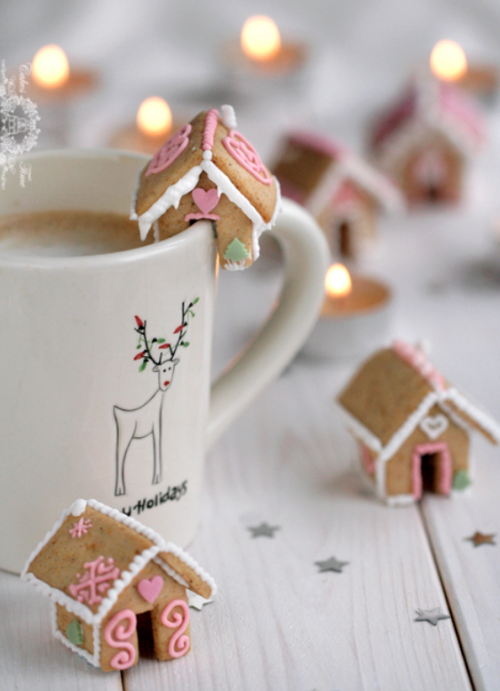
At what (x,y) coordinates should I click in order to perform the action: click on 4 green christmas lights. Please return your answer as a coordinate pair (x, y). The width and height of the screenshot is (500, 691). Looking at the image, I should click on (147, 361), (159, 336), (185, 340), (195, 296).